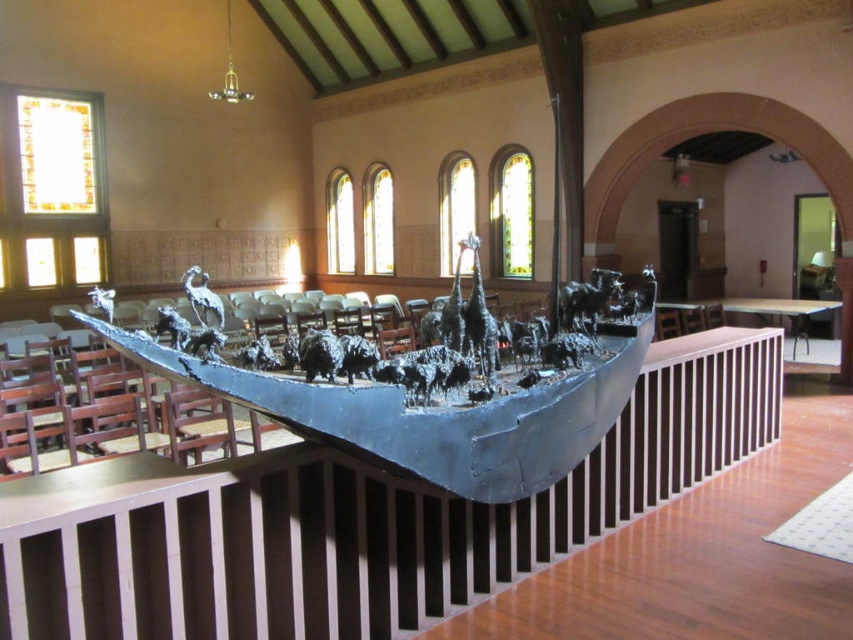
You are an interior designer planning to place a new sculpture in the room. The shiny metallic boat at center and the shiny silver crane at center are already present. Which of the two objects is smaller?

The shiny metallic boat at center is smaller than the shiny silver crane at center.